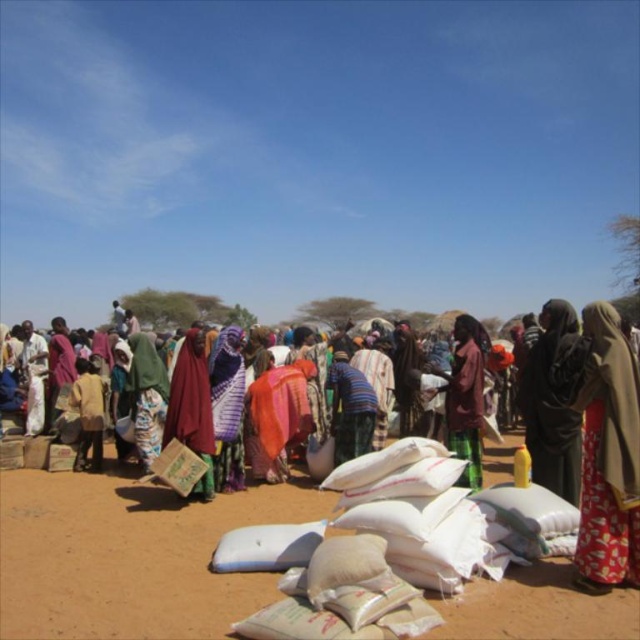
You are a traveler who just arrived at this market and want to buy a scarf. You see the printed cotton dress at lower right and the matte purple scarf at center. Which item is closer to you?

The printed cotton dress at lower right is closer to you because it is in front of the matte purple scarf at center.